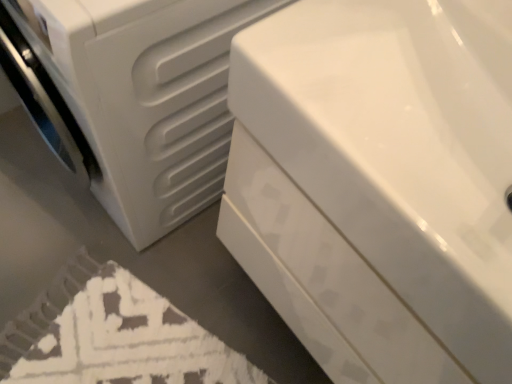
Where is `white matte washing machine at left`? white matte washing machine at left is located at coordinates (141, 97).

The width and height of the screenshot is (512, 384). What do you see at coordinates (113, 335) in the screenshot? I see `white textured bath mat at lower left` at bounding box center [113, 335].

Where is `white glossy bathtub at center`? white glossy bathtub at center is located at coordinates (378, 184).

I want to click on white matte washing machine at left, so click(x=141, y=97).

Is point (109, 25) in front of point (500, 218)?

That is False.

You are a GUI agent. You are given a task and a screenshot of the screen. Output one action in this format:
    pyautogui.click(x=<x>, y=<y>)
    Task: Click on the washing machine on the left side of white glossy bathtub at center
    This screenshot has height=384, width=512.
    Given the screenshot: What is the action you would take?
    pyautogui.click(x=141, y=97)

Is white matte washing machine at left not near white glossy bathtub at center?

No, there isn't a large distance between white matte washing machine at left and white glossy bathtub at center.

Is white matte washing machine at left further to camera compared to white glossy bathtub at center?

Yes.

Is white glossy bathtub at center aimed at white textured bath mat at lower left?

No, white glossy bathtub at center is not aimed at white textured bath mat at lower left.

Can you tell me how much white glossy bathtub at center and white textured bath mat at lower left differ in facing direction?

73.8 degrees separate the facing orientations of white glossy bathtub at center and white textured bath mat at lower left.

Does white glossy bathtub at center have a greater width compared to white textured bath mat at lower left?

No.

Is white glossy bathtub at center outside of white textured bath mat at lower left?

white glossy bathtub at center lies outside white textured bath mat at lower left's area.

Considering the positions of objects white glossy bathtub at center and white matte washing machine at left in the image provided, who is in front, white glossy bathtub at center or white matte washing machine at left?

Positioned in front is white glossy bathtub at center.

How different are the orientations of white glossy bathtub at center and white matte washing machine at left in degrees?

There is a 0.363-degree angle between the facing directions of white glossy bathtub at center and white matte washing machine at left.

Is white glossy bathtub at center situated inside white matte washing machine at left or outside?

white glossy bathtub at center is spatially situated outside white matte washing machine at left.

Considering the relative sizes of white textured bath mat at lower left and white matte washing machine at left in the image provided, is white textured bath mat at lower left taller than white matte washing machine at left?

Incorrect, the height of white textured bath mat at lower left is not larger of that of white matte washing machine at left.

Is white textured bath mat at lower left not near white matte washing machine at left?

No, white textured bath mat at lower left is not far away from white matte washing machine at left.

Looking at this image, which object is closer to the camera taking this photo, white textured bath mat at lower left or white matte washing machine at left?

white matte washing machine at left is more forward.

Is point (71, 285) positioned after point (137, 192)?

Yes, point (71, 285) is behind point (137, 192).

From a real-world perspective, who is located higher, white matte washing machine at left or white textured bath mat at lower left?

white matte washing machine at left, from a real-world perspective.

How many degrees apart are the facing directions of white matte washing machine at left and white textured bath mat at lower left?

They differ by 73.5 degrees in their facing directions.

Find the location of a particular element. The image size is (512, 384). washing machine above the white textured bath mat at lower left (from a real-world perspective) is located at coordinates (141, 97).

Considering the relative positions of white matte washing machine at left and white textured bath mat at lower left in the image provided, is white matte washing machine at left to the left of white textured bath mat at lower left from the viewer's perspective?

No, white matte washing machine at left is not to the left of white textured bath mat at lower left.

Does white textured bath mat at lower left have a greater width compared to white glossy bathtub at center?

Correct, the width of white textured bath mat at lower left exceeds that of white glossy bathtub at center.

From a real-world perspective, which is physically above, white textured bath mat at lower left or white glossy bathtub at center?

white glossy bathtub at center.

Can you tell me how much white textured bath mat at lower left and white glossy bathtub at center differ in facing direction?

73.8 degrees separate the facing orientations of white textured bath mat at lower left and white glossy bathtub at center.

Where is `bath to the right of white matte washing machine at left`? The height and width of the screenshot is (384, 512). bath to the right of white matte washing machine at left is located at coordinates (378, 184).

Where is `bath mat that is on the left side of white glossy bathtub at center`? Image resolution: width=512 pixels, height=384 pixels. bath mat that is on the left side of white glossy bathtub at center is located at coordinates tap(113, 335).

Based on their spatial positions, is white glossy bathtub at center or white matte washing machine at left further from white textured bath mat at lower left?

white glossy bathtub at center lies further to white textured bath mat at lower left than the other object.

Considering their positions, is white matte washing machine at left positioned further to white textured bath mat at lower left than white glossy bathtub at center?

Based on the image, white glossy bathtub at center appears to be further to white textured bath mat at lower left.

Looking at this image, considering their positions, is white textured bath mat at lower left positioned closer to white matte washing machine at left than white glossy bathtub at center?

A: white glossy bathtub at center.

From the image, which object appears to be farther from white glossy bathtub at center, white textured bath mat at lower left or white matte washing machine at left?

white textured bath mat at lower left lies further to white glossy bathtub at center than the other object.

Estimate the real-world distances between objects in this image. Which object is further from white glossy bathtub at center, white matte washing machine at left or white textured bath mat at lower left?

white textured bath mat at lower left is positioned further to the anchor white glossy bathtub at center.

Which object lies further to the anchor point white matte washing machine at left, white glossy bathtub at center or white textured bath mat at lower left?

Among the two, white textured bath mat at lower left is located further to white matte washing machine at left.

Identify the location of bath between white matte washing machine at left and white textured bath mat at lower left in the up-down direction. This screenshot has height=384, width=512. (378, 184).